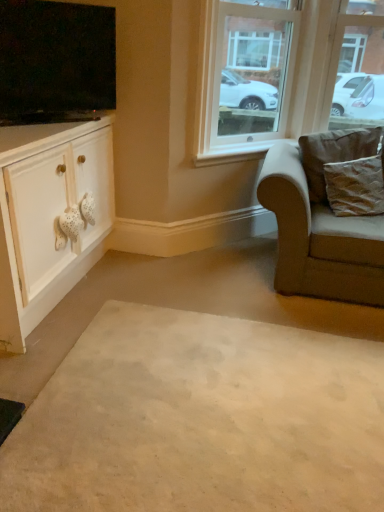
Describe the element at coordinates (201, 419) in the screenshot. This screenshot has height=512, width=384. I see `beige carpet at center` at that location.

The height and width of the screenshot is (512, 384). Describe the element at coordinates (56, 62) in the screenshot. I see `flat screen tv at upper left` at that location.

What do you see at coordinates (319, 238) in the screenshot?
I see `beige fabric chair at right` at bounding box center [319, 238].

You are a GUI agent. You are given a task and a screenshot of the screen. Output one action in this format:
    pyautogui.click(x=<x>, y=<y>)
    Task: Click on the white matte cabinet at left
    Image resolution: width=384 pixels, height=512 pixels.
    Given the screenshot: What is the action you would take?
    point(50,214)

Would you say white matte cabinet at left is to the left or to the right of brown textured pillow at right, the first pillow ordered from the bottom, in the picture?

white matte cabinet at left is to the left of brown textured pillow at right, the first pillow ordered from the bottom.

From the picture: Would you say white matte cabinet at left is outside brown textured pillow at right, the first pillow ordered from the bottom?

Yes, white matte cabinet at left is located beyond the bounds of brown textured pillow at right, the first pillow ordered from the bottom.

Considering the sizes of white matte cabinet at left and brown textured pillow at right, the first pillow ordered from the bottom, in the image, is white matte cabinet at left taller or shorter than brown textured pillow at right, the first pillow ordered from the bottom,?

Clearly, white matte cabinet at left is taller compared to brown textured pillow at right, the first pillow ordered from the bottom.

From the picture: From a real-world perspective, is white matte cabinet at left positioned above or below brown textured pillow at right, the 2th pillow from the top?

white matte cabinet at left is situated lower than brown textured pillow at right, the 2th pillow from the top, in the real world.

The image size is (384, 512). I want to click on television above the beige fabric chair at right (from the image's perspective), so click(56, 62).

From the image's perspective, which one is positioned lower, beige fabric chair at right or flat screen tv at upper left?

beige fabric chair at right is shown below in the image.

Is beige fabric chair at right thinner than flat screen tv at upper left?

Incorrect, the width of beige fabric chair at right is not less than that of flat screen tv at upper left.

Considering the relative positions of clear glass window at upper center and flat screen tv at upper left in the image provided, is clear glass window at upper center in front of flat screen tv at upper left?

No, clear glass window at upper center is further to the viewer.

From a real-world perspective, which is physically below, clear glass window at upper center or flat screen tv at upper left?

From a 3D spatial view, clear glass window at upper center is below.

Can you confirm if clear glass window at upper center is shorter than flat screen tv at upper left?

In fact, clear glass window at upper center may be taller than flat screen tv at upper left.

Which is more to the right, clear glass window at upper center or flat screen tv at upper left?

clear glass window at upper center.

From the image's perspective, which one is positioned lower, clear glass window at upper center or white matte cabinet at left?

white matte cabinet at left is shown below in the image.

Considering the sizes of objects clear glass window at upper center and white matte cabinet at left in the image provided, who is smaller, clear glass window at upper center or white matte cabinet at left?

With smaller size is clear glass window at upper center.

From a real-world perspective, relative to white matte cabinet at left, is clear glass window at upper center vertically above or below?

Clearly, from a real-world perspective, clear glass window at upper center is above white matte cabinet at left.

Considering the sizes of objects clear glass window at upper center and white matte cabinet at left in the image provided, who is thinner, clear glass window at upper center or white matte cabinet at left?

clear glass window at upper center.

What are the coordinates of `television in front of the brown textured pillow at right, the second pillow positioned from the bottom` in the screenshot? It's located at (56, 62).

Is brown textured pillow at right, the second pillow positioned from the bottom, positioned far away from flat screen tv at upper left?

brown textured pillow at right, the second pillow positioned from the bottom, is positioned a significant distance from flat screen tv at upper left.

From the image's perspective, is brown textured pillow at right, placed as the first pillow when sorted from top to bottom, beneath flat screen tv at upper left?

Yes, from the image's perspective, brown textured pillow at right, placed as the first pillow when sorted from top to bottom, is beneath flat screen tv at upper left.

Find the location of a particular element. television located above the white matte cabinet at left (from a real-world perspective) is located at coordinates (56, 62).

Is white matte cabinet at left beside flat screen tv at upper left?

No, white matte cabinet at left is not with flat screen tv at upper left.

Which object is thinner, white matte cabinet at left or flat screen tv at upper left?

flat screen tv at upper left is thinner.

Considering the relative sizes of white matte cabinet at left and flat screen tv at upper left in the image provided, is white matte cabinet at left smaller than flat screen tv at upper left?

Actually, white matte cabinet at left might be larger than flat screen tv at upper left.

Do you think flat screen tv at upper left is within beige carpet at center, or outside of it?

flat screen tv at upper left lies outside beige carpet at center.

Which object is positioned more to the right, flat screen tv at upper left or beige carpet at center?

beige carpet at center is more to the right.

Considering the sizes of objects flat screen tv at upper left and beige carpet at center in the image provided, who is wider, flat screen tv at upper left or beige carpet at center?

beige carpet at center.

Based on the photo, is flat screen tv at upper left facing towards beige carpet at center?

No, flat screen tv at upper left is not facing towards beige carpet at center.

Locate an element on the screen. The height and width of the screenshot is (512, 384). cabinetry below the brown textured pillow at right, the first pillow ordered from the bottom (from the image's perspective) is located at coordinates (50, 214).

At what (x,y) coordinates should I click in order to perform the action: click on chair behind the flat screen tv at upper left. Please return your answer as a coordinate pair (x, y). Looking at the image, I should click on (319, 238).

From the image, which object appears to be farther from white matte cabinet at left, brown textured pillow at right, the 2th pillow from the top, or clear glass window at upper center?

brown textured pillow at right, the 2th pillow from the top, is positioned further to the anchor white matte cabinet at left.

Looking at the image, which one is located closer to brown textured pillow at right, the 2th pillow from the top, beige carpet at center or white matte cabinet at left?

beige carpet at center is closer to brown textured pillow at right, the 2th pillow from the top.

Which object lies further to the anchor point beige carpet at center, beige fabric chair at right or flat screen tv at upper left?

flat screen tv at upper left is further to beige carpet at center.

Which object lies further to the anchor point beige carpet at center, clear glass window at upper center or flat screen tv at upper left?

The object further to beige carpet at center is clear glass window at upper center.

Looking at the image, which one is located closer to clear glass window at upper center, brown textured pillow at right, the 2th pillow from the top, or beige fabric chair at right?

beige fabric chair at right lies closer to clear glass window at upper center than the other object.

Based on their spatial positions, is brown textured pillow at right, placed as the first pillow when sorted from top to bottom, or flat screen tv at upper left further from clear glass window at upper center?

flat screen tv at upper left is further to clear glass window at upper center.

From the image, which object appears to be farther from white matte cabinet at left, brown textured pillow at right, the first pillow ordered from the bottom, or brown textured pillow at right, the second pillow positioned from the bottom?

brown textured pillow at right, the first pillow ordered from the bottom.

Estimate the real-world distances between objects in this image. Which object is closer to beige fabric chair at right, white matte cabinet at left or flat screen tv at upper left?

white matte cabinet at left is positioned closer to the anchor beige fabric chair at right.

This screenshot has height=512, width=384. Identify the location of chair between white matte cabinet at left and brown textured pillow at right, placed as the first pillow when sorted from top to bottom, in the horizontal direction. (319, 238).

The image size is (384, 512). Identify the location of window located between white matte cabinet at left and brown textured pillow at right, the second pillow positioned from the bottom, in the left-right direction. (285, 78).

Image resolution: width=384 pixels, height=512 pixels. What are the coordinates of `pillow between beige carpet at center and brown textured pillow at right, the second pillow positioned from the bottom, in the front-back direction` in the screenshot? It's located at (355, 187).

What are the coordinates of `chair located between flat screen tv at upper left and brown textured pillow at right, the first pillow ordered from the bottom, in the left-right direction` in the screenshot? It's located at (319, 238).